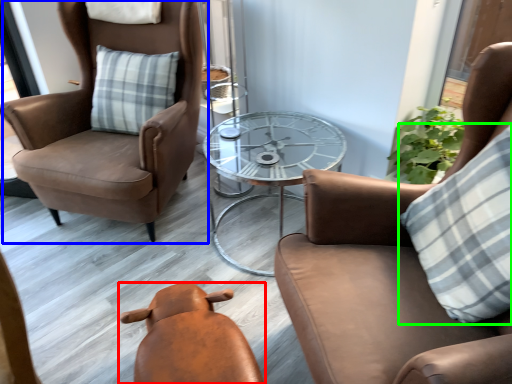
Question: Estimate the real-world distances between objects in this image. Which object is farther from chair (highlighted by a red box), chair (highlighted by a blue box) or pillow (highlighted by a green box)?

Choices:
 (A) chair
 (B) pillow

Answer: (A)